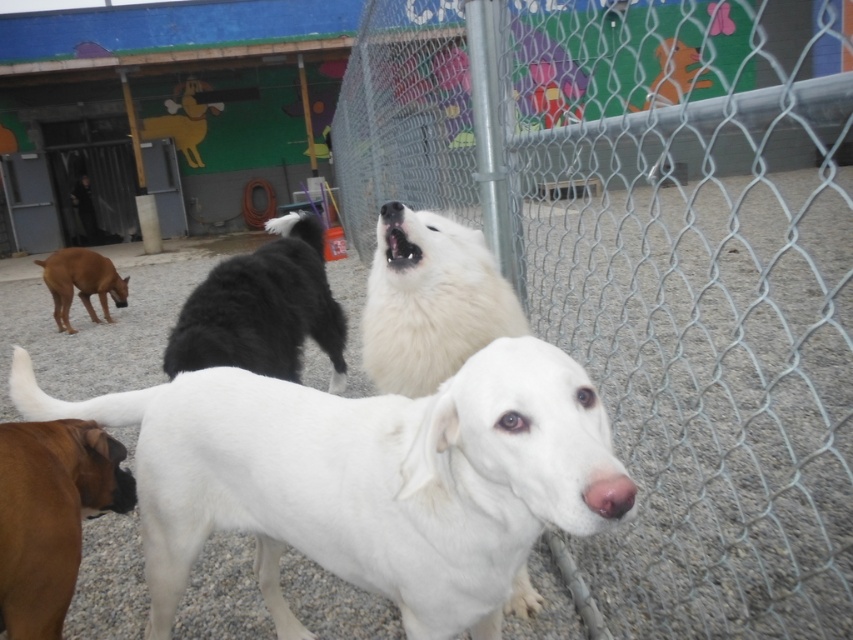
You are a dog trainer who wants to separate the white smooth dog at center and the black fluffy dog at center using a divider that is 1 meter wide. Is the divider wide enough to fit between them?

The distance between the white smooth dog at center and the black fluffy dog at center is 1.16 meters, so the 1 meter wide divider is not wide enough to fit between them. You need a divider that is at least 1.16 meters wide.

You are standing at the point labeled point (x=24, y=360) and want to walk towards the point labeled point (x=289, y=344). Since you can only move forward, will you have to go around any obstacles between these two points?

Point (x=24, y=360) is in front of point (x=289, y=344), so you will not have to go around any obstacles between these two points because the path is clear.

You are a dog trainer who needs to approach the white smooth dog at center for a checkup. Considering your height and the distance between you and the dog, can you safely reach the dog without stepping into the fenced area?

The white smooth dog at center and viewer are 26.75 inches apart from each other. Since the distance is relatively short, you can safely reach the dog without entering the fenced area by extending your arm or using a long tool if needed.